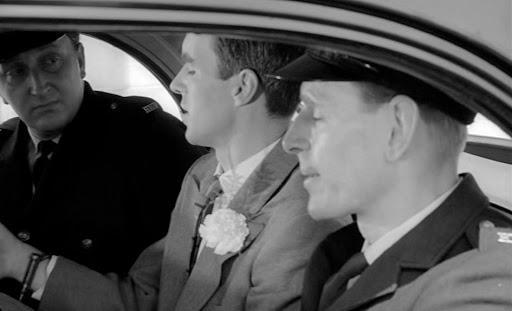
What are the coordinates of `window` in the screenshot? It's located at 490,139, 129,74.